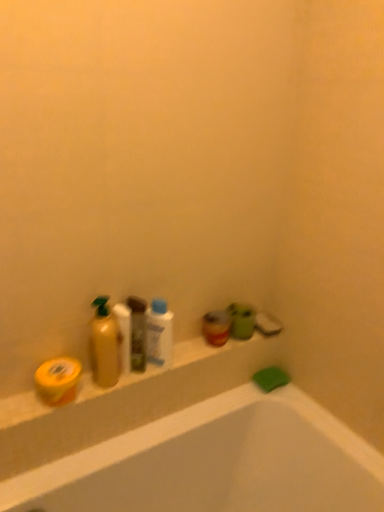
Question: Does yellow matte container at lower left come in front of white glossy mouthwash at center, positioned as the 1th mouthwash in front-to-back order?

Choices:
 (A) no
 (B) yes

Answer: (B)

Question: Can you confirm if yellow matte container at lower left is thinner than white glossy mouthwash at center, positioned as the 1th mouthwash in front-to-back order?

Choices:
 (A) no
 (B) yes

Answer: (A)

Question: Is white glossy mouthwash at center, arranged as the 2th mouthwash when viewed from the right, inside yellow matte container at lower left?

Choices:
 (A) yes
 (B) no

Answer: (B)

Question: Is yellow matte container at lower left outside of white glossy mouthwash at center, which is the 2th mouthwash from back to front?

Choices:
 (A) yes
 (B) no

Answer: (A)

Question: Is yellow matte container at lower left to the left of white glossy mouthwash at center, the 1th mouthwash viewed from the left, from the viewer's perspective?

Choices:
 (A) no
 (B) yes

Answer: (A)

Question: Considering the positions of green matte soap at lower right, which appears as the 1th soap when viewed from the back, and shiny gold bottle at left in the image, is green matte soap at lower right, which appears as the 1th soap when viewed from the back, taller or shorter than shiny gold bottle at left?

Choices:
 (A) tall
 (B) short

Answer: (B)

Question: Is green matte soap at lower right, which appears as the 1th soap when viewed from the back, wider or thinner than shiny gold bottle at left?

Choices:
 (A) wide
 (B) thin

Answer: (B)

Question: Which is correct: green matte soap at lower right, which appears as the 1th soap when viewed from the back, is inside shiny gold bottle at left, or outside of it?

Choices:
 (A) outside
 (B) inside

Answer: (A)

Question: Considering their positions, is green matte soap at lower right, the 1th soap positioned from the right, located in front of or behind shiny gold bottle at left?

Choices:
 (A) front
 (B) behind

Answer: (B)

Question: Would you say yellow matte bar of soap at left, the 2th soap from the back, is to the left or to the right of yellow matte container at lower left in the picture?

Choices:
 (A) left
 (B) right

Answer: (A)

Question: Would you say yellow matte bar of soap at left, positioned as the 1th soap in front-to-back order, is inside or outside yellow matte container at lower left?

Choices:
 (A) inside
 (B) outside

Answer: (B)

Question: Is yellow matte bar of soap at left, which ranks as the second soap in bottom-to-top order, wider or thinner than yellow matte container at lower left?

Choices:
 (A) wide
 (B) thin

Answer: (A)

Question: From a real-world perspective, is yellow matte bar of soap at left, arranged as the first soap when viewed from the left, physically located above or below yellow matte container at lower left?

Choices:
 (A) above
 (B) below

Answer: (A)

Question: Considering the positions of yellow matte bar of soap at left, which is the second soap from right to left, and white glossy mouthwash at center, arranged as the 2th mouthwash when viewed from the right, in the image, is yellow matte bar of soap at left, which is the second soap from right to left, wider or thinner than white glossy mouthwash at center, arranged as the 2th mouthwash when viewed from the right,?

Choices:
 (A) thin
 (B) wide

Answer: (B)

Question: Is yellow matte bar of soap at left, the 2th soap from the back, taller or shorter than white glossy mouthwash at center, which is the 2th mouthwash from back to front?

Choices:
 (A) tall
 (B) short

Answer: (B)